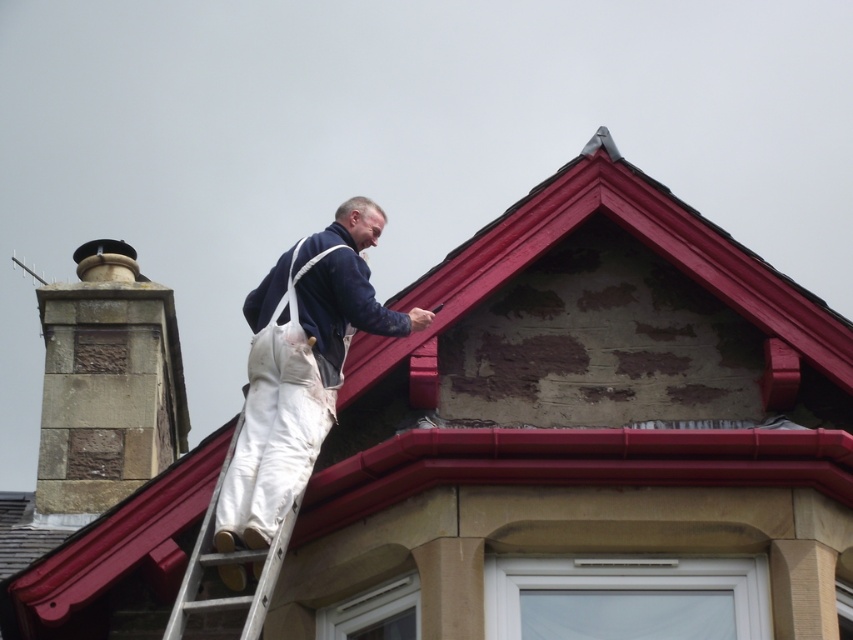
Measure the distance from brown stone chimney at left to white fabric ladder at center.

A distance of 25.76 meters exists between brown stone chimney at left and white fabric ladder at center.

Is brown stone chimney at left wider than white fabric ladder at center?

A: Indeed, brown stone chimney at left has a greater width compared to white fabric ladder at center.

Does point (102, 454) lie behind point (264, 579)?

Yes, it is behind point (264, 579).

Where is `brown stone chimney at left`? The width and height of the screenshot is (853, 640). brown stone chimney at left is located at coordinates (106, 385).

Who is taller, brown stone chimney at left or white canvas overalls at upper center?

Standing taller between the two is white canvas overalls at upper center.

Can you confirm if brown stone chimney at left is positioned below white canvas overalls at upper center?

Correct, brown stone chimney at left is located below white canvas overalls at upper center.

Looking at this image, who is more distant from viewer, (56,429) or (297,378)?

The point (56,429) is behind.

I want to click on brown stone chimney at left, so click(x=106, y=385).

What do you see at coordinates (300, 369) in the screenshot? I see `white canvas overalls at upper center` at bounding box center [300, 369].

Identify the location of white canvas overalls at upper center. (300, 369).

The height and width of the screenshot is (640, 853). What are the coordinates of `white canvas overalls at upper center` in the screenshot? It's located at (300, 369).